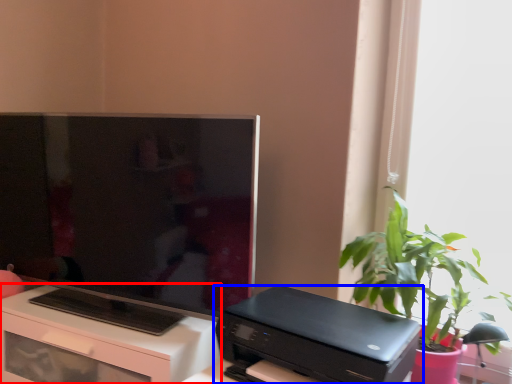
Question: Which point is further to the camera, desk (highlighted by a red box) or printer (highlighted by a blue box)?

Choices:
 (A) desk
 (B) printer

Answer: (A)